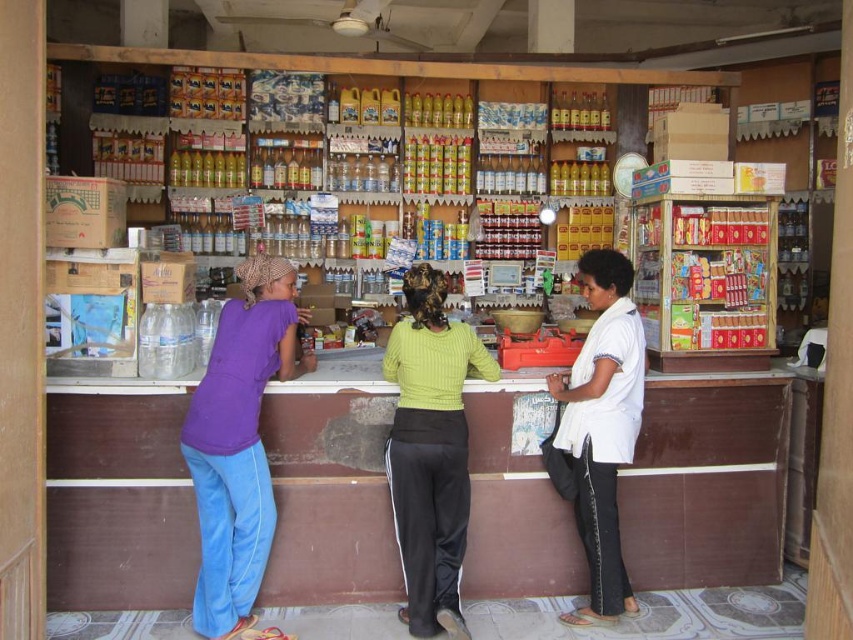
You are a customer in the shop and want to buy the purple cotton shirt at left located at point (238, 442). The shop has a counter at the center. Can you walk directly to the purple cotton shirt at left from your current position behind the counter?

The purple cotton shirt at left is located at point (238, 442). Since you are behind the counter, you can walk directly to it as there are no obstructions mentioned in the scene description.

You are a customer in the shop and want to buy a gift for a friend. You notice the purple cotton shirt at left and the ribbed green sweater at center. Which one is bigger in size?

The purple cotton shirt at left has a larger size compared to the ribbed green sweater at center, so the purple cotton shirt at left is bigger.